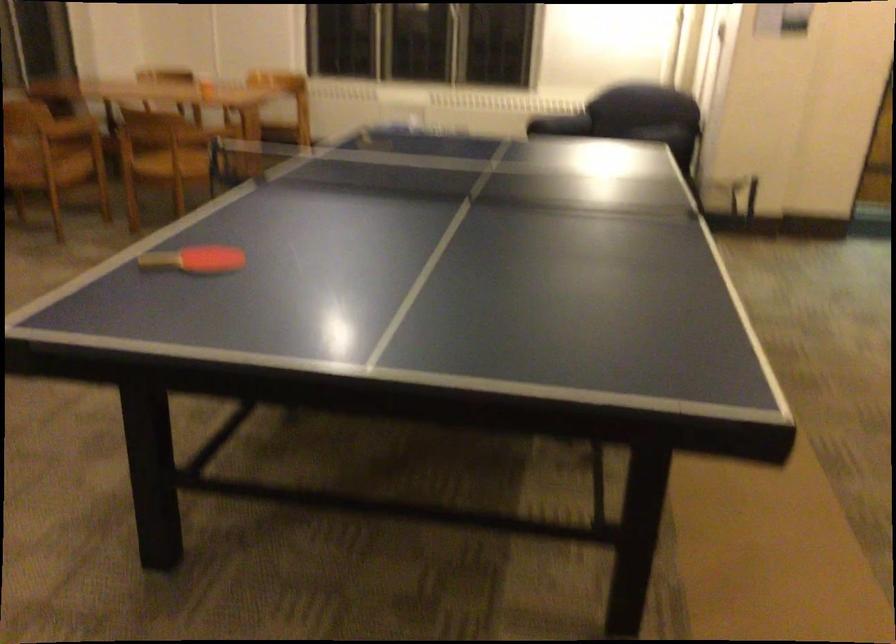
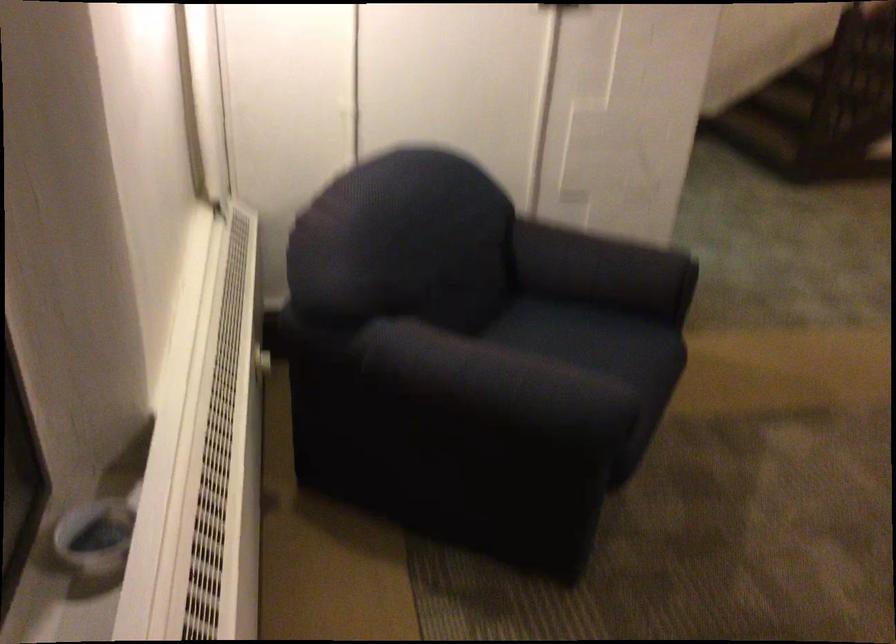
The point at (x=547, y=96) is marked in the first image. Where is the corresponding point in the second image?

(218, 462)